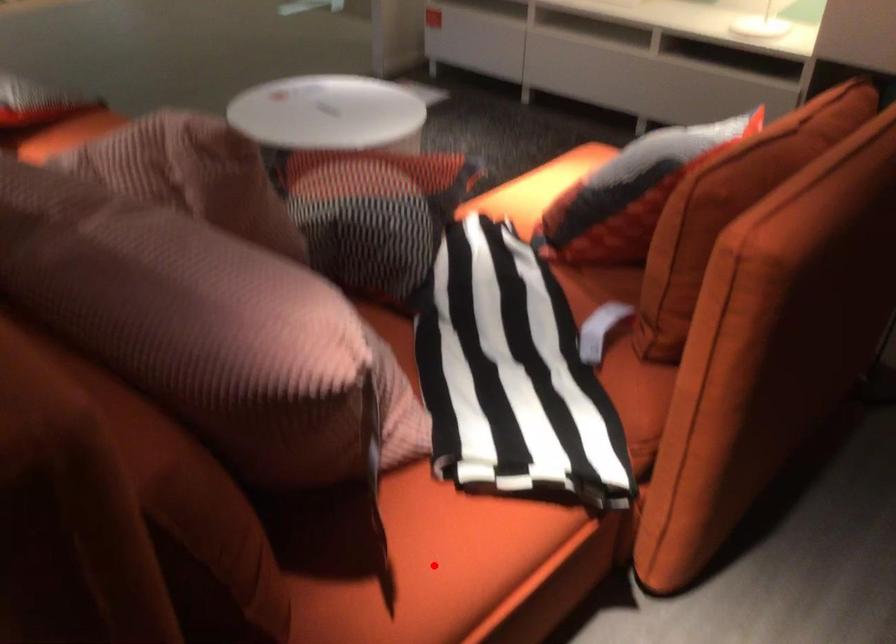
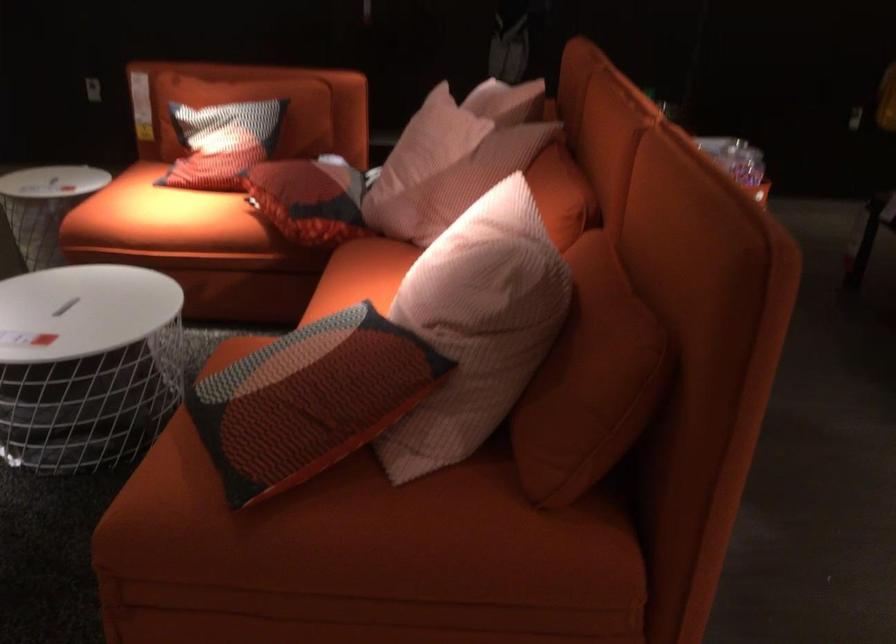
Question: I am providing you with two images of the same scene from different viewpoints. A red point is marked on the first image. Is the red point's position out of view in image 2?

Choices:
 (A) Yes
 (B) No

Answer: (A)